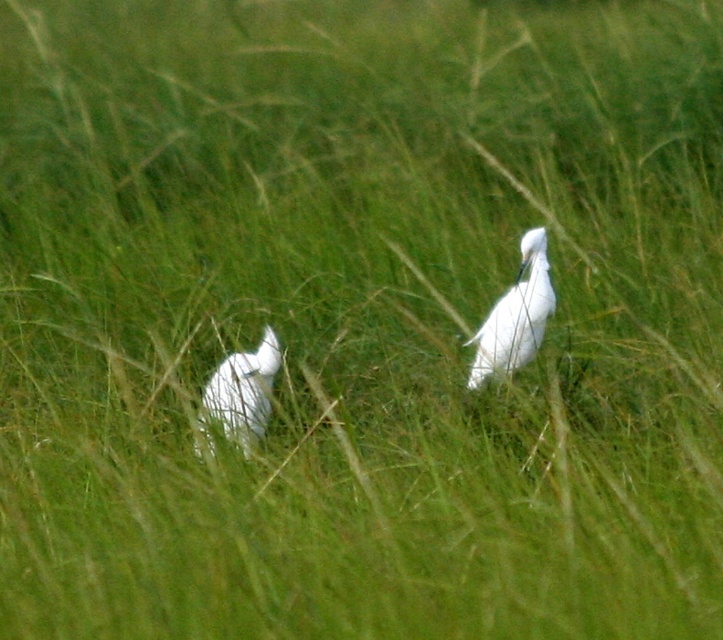
You are a photographer aiming to capture the white smooth bird at center in the image. You need to place a marker at point (515, 316). Is this point on the bird?

Yes, the point (515, 316) is on the white smooth bird at center, making it an ideal spot for placing the marker to ensure the bird is in focus.

You are a wildlife photographer aiming to capture both the white smooth bird at center and the white feathered bird at center in a single frame. Based on their positions, which bird would require you to adjust your camera angle more to ensure both are fully visible?

The white smooth bird at center might require adjusting the camera angle more since it is wider than the white feathered bird at center, necessitating a wider field of view to capture both birds fully.